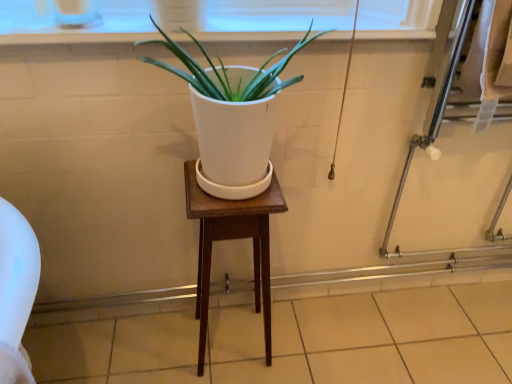
Question: Is beige tile at lower center located within clear glass screen door at right?

Choices:
 (A) no
 (B) yes

Answer: (A)

Question: Is clear glass screen door at right far away from beige tile at lower center?

Choices:
 (A) no
 (B) yes

Answer: (A)

Question: From the image's perspective, is clear glass screen door at right below beige tile at lower center?

Choices:
 (A) no
 (B) yes

Answer: (A)

Question: Is clear glass screen door at right oriented away from beige tile at lower center?

Choices:
 (A) yes
 (B) no

Answer: (B)

Question: From a real-world perspective, is clear glass screen door at right physically above beige tile at lower center?

Choices:
 (A) no
 (B) yes

Answer: (B)

Question: Is clear glass screen door at right outside of beige tile at lower center?

Choices:
 (A) yes
 (B) no

Answer: (A)

Question: Is beige tile at lower center behind white plastic window frame at upper center?

Choices:
 (A) yes
 (B) no

Answer: (A)

Question: Does beige tile at lower center have a lesser width compared to white plastic window frame at upper center?

Choices:
 (A) yes
 (B) no

Answer: (B)

Question: From a real-world perspective, does beige tile at lower center stand above white plastic window frame at upper center?

Choices:
 (A) yes
 (B) no

Answer: (B)

Question: Is beige tile at lower center positioned before white plastic window frame at upper center?

Choices:
 (A) no
 (B) yes

Answer: (A)

Question: Can you confirm if beige tile at lower center is positioned to the left of white plastic window frame at upper center?

Choices:
 (A) no
 (B) yes

Answer: (A)

Question: Is beige tile at lower center oriented towards white plastic window frame at upper center?

Choices:
 (A) no
 (B) yes

Answer: (A)

Question: Is wooden stool at center facing away from beige tile at lower center?

Choices:
 (A) no
 (B) yes

Answer: (A)